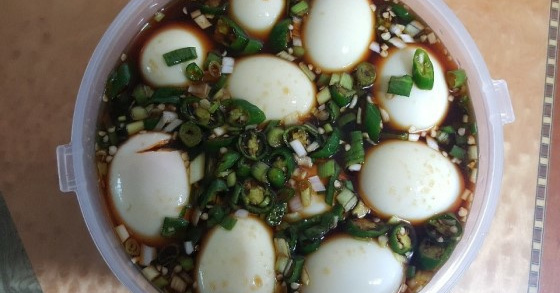
Where is `surface holding bowl of soup`? This screenshot has width=560, height=293. surface holding bowl of soup is located at coordinates (48, 252).